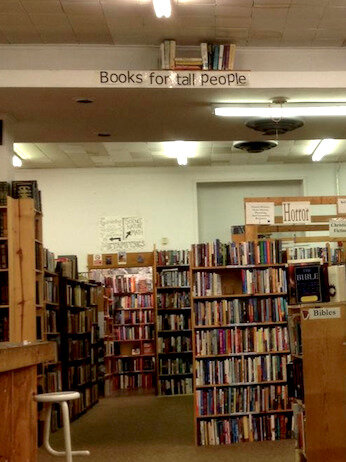
At what (x,y) coordinates should I click in order to perform the action: click on vent. Please return your answer as a coordinate pair (x, y). The image size is (346, 462). Looking at the image, I should click on (254, 147), (266, 128).